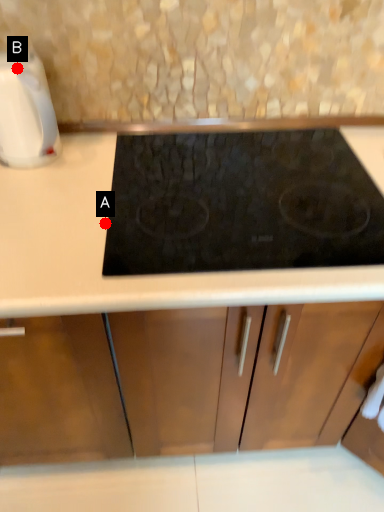
Question: Two points are circled on the image, labeled by A and B beside each circle. Among these points, which one is farthest from the camera?

Choices:
 (A) A is further
 (B) B is further

Answer: (B)